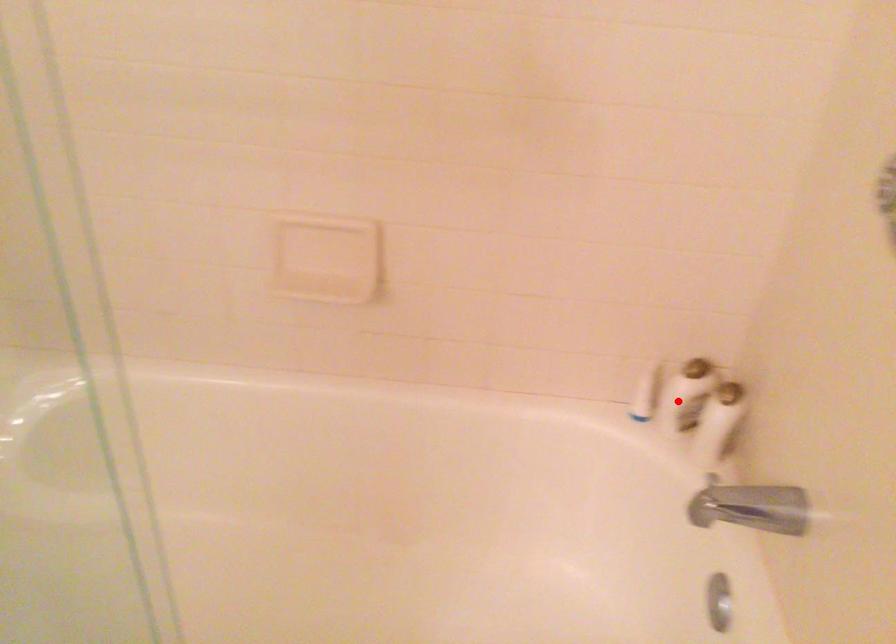
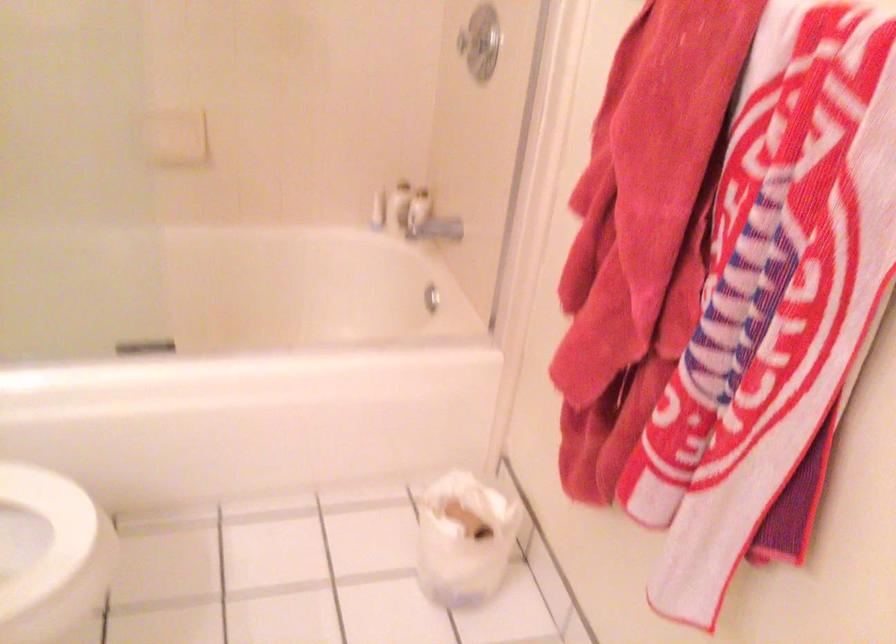
The point at the highlighted location is marked in the first image. Where is the corresponding point in the second image?

(399, 205)